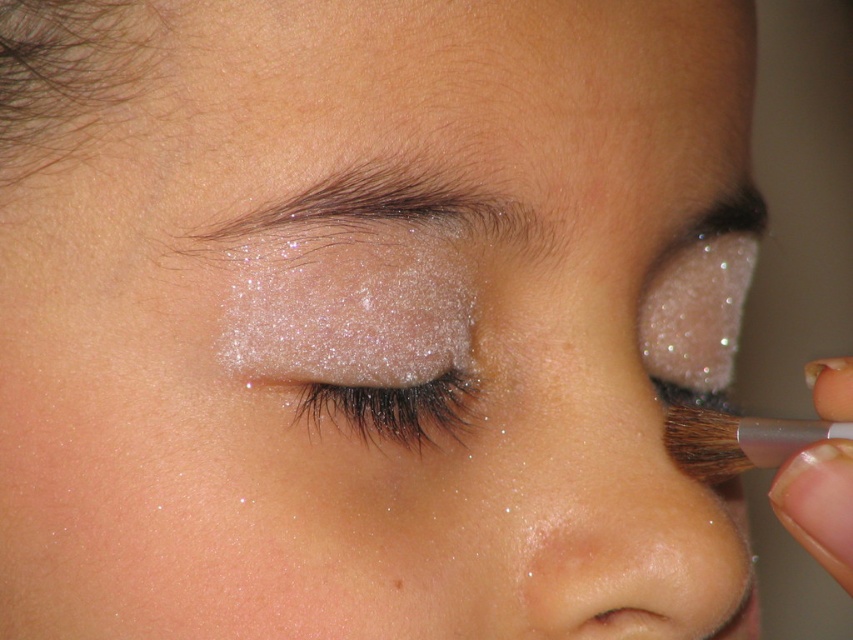
Does slightly shiny dark brown eyebrow at upper center have a lesser height compared to shimmering glitter eye at center?

In fact, slightly shiny dark brown eyebrow at upper center may be taller than shimmering glitter eye at center.

Who is more forward, (250, 269) or (373, 424)?

Positioned in front is point (250, 269).

Is point (462, 172) positioned after point (293, 420)?

No, it is not.

Identify the location of slightly shiny dark brown eyebrow at upper center. Image resolution: width=853 pixels, height=640 pixels. (386, 212).

Does slightly shiny dark brown eyebrow at upper center come behind brown matte freckle at center?

No, it is in front of brown matte freckle at center.

Can you confirm if slightly shiny dark brown eyebrow at upper center is smaller than brown matte freckle at center?

Incorrect, slightly shiny dark brown eyebrow at upper center is not smaller in size than brown matte freckle at center.

Does point (251, 234) lie in front of point (398, 580)?

Yes, it is in front of point (398, 580).

At what (x,y) coordinates should I click in order to perform the action: click on slightly shiny dark brown eyebrow at upper center. Please return your answer as a coordinate pair (x, y). Looking at the image, I should click on click(x=386, y=212).

Is shimmering glitter eye at center shorter than brown matte freckle at center?

Incorrect, shimmering glitter eye at center's height does not fall short of brown matte freckle at center's.

Is shimmering glitter eye at center wider than brown matte freckle at center?

Indeed, shimmering glitter eye at center has a greater width compared to brown matte freckle at center.

Between point (459, 372) and point (397, 592), which one is positioned in front?

Point (397, 592) is in front.

The width and height of the screenshot is (853, 640). What are the coordinates of `shimmering glitter eye at center` in the screenshot? It's located at (393, 406).